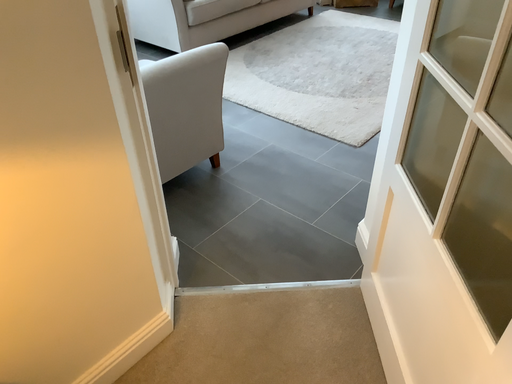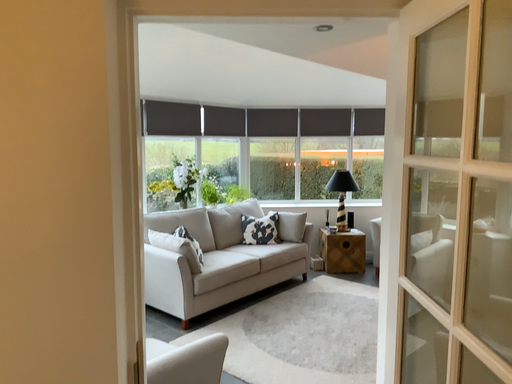
Question: How did the camera likely rotate when shooting the video?

Choices:
 (A) rotated upward
 (B) rotated downward

Answer: (A)